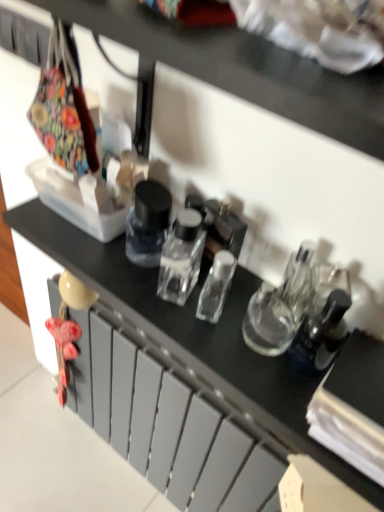
Question: Relative to transparent glass bottle at center, is matte gray drawer at center in front or behind?

Choices:
 (A) front
 (B) behind

Answer: (B)

Question: In terms of width, does matte gray drawer at center look wider or thinner when compared to transparent glass bottle at center?

Choices:
 (A) wide
 (B) thin

Answer: (A)

Question: From the image's perspective, is matte gray drawer at center positioned above or below transparent glass bottle at center?

Choices:
 (A) below
 (B) above

Answer: (A)

Question: Looking at the image, does transparent glass bottle at center seem bigger or smaller compared to matte gray drawer at center?

Choices:
 (A) big
 (B) small

Answer: (B)

Question: From the image's perspective, relative to matte gray drawer at center, is transparent glass bottle at center above or below?

Choices:
 (A) below
 (B) above

Answer: (B)

Question: Is transparent glass bottle at center in front of or behind matte gray drawer at center in the image?

Choices:
 (A) behind
 (B) front

Answer: (B)

Question: In terms of height, does transparent glass bottle at center look taller or shorter compared to matte gray drawer at center?

Choices:
 (A) tall
 (B) short

Answer: (B)